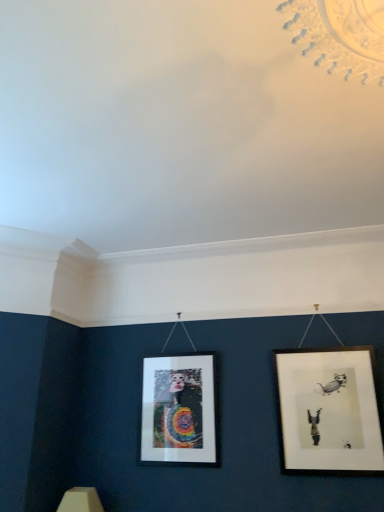
The image size is (384, 512). What are the coordinates of `matte black frame at center` in the screenshot? It's located at (179, 410).

The height and width of the screenshot is (512, 384). Describe the element at coordinates (179, 410) in the screenshot. I see `matte black frame at center` at that location.

In order to face matte black frame at center, should I rotate leftwards or rightwards?

A 1.887 degree turn to the left will do.

The image size is (384, 512). I want to click on matte black frame at center, so click(179, 410).